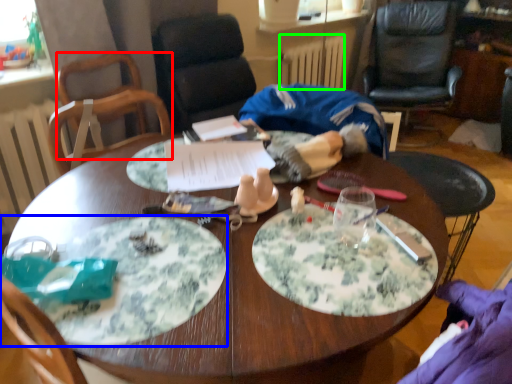
Question: Based on their relative distances, which object is farther from chair (highlighted by a red box)? Choose from plate (highlighted by a blue box) and radiator (highlighted by a green box).

Choices:
 (A) plate
 (B) radiator

Answer: (B)